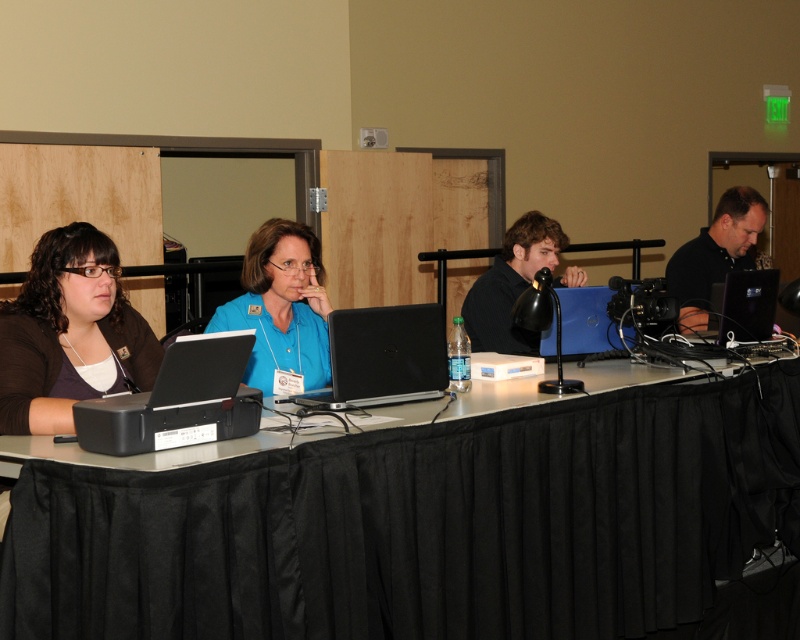
Between blue fabric shirt at center and black matte laptop at center, which one appears on the right side from the viewer's perspective?

Positioned to the right is black matte laptop at center.

In the scene shown: Can you confirm if blue fabric shirt at center is positioned below black matte laptop at center?

Actually, blue fabric shirt at center is above black matte laptop at center.

At what (x,y) coordinates should I click in order to perform the action: click on blue fabric shirt at center. Please return your answer as a coordinate pair (x, y). Looking at the image, I should click on (281, 307).

You are a GUI agent. You are given a task and a screenshot of the screen. Output one action in this format:
    pyautogui.click(x=<x>, y=<y>)
    Task: Click on the black matte shirt at right
    The image size is (800, 640).
    Given the screenshot: What is the action you would take?
    pyautogui.click(x=714, y=253)

At what (x,y) coordinates should I click in order to perform the action: click on black matte shirt at right. Please return your answer as a coordinate pair (x, y). The width and height of the screenshot is (800, 640). Looking at the image, I should click on (714, 253).

Where is `black matte shirt at right`? This screenshot has height=640, width=800. black matte shirt at right is located at coordinates (714, 253).

Can you confirm if black fabric table at center is wider than blue fabric shirt at center?

Yes.

Who is more distant from viewer, [398,428] or [272,390]?

Positioned behind is point [272,390].

Is point (578, 509) farther from camera compared to point (285, 360)?

That is False.

At what (x,y) coordinates should I click in order to perform the action: click on black fabric table at center. Please return your answer as a coordinate pair (x, y). This screenshot has width=800, height=640. Looking at the image, I should click on (424, 525).